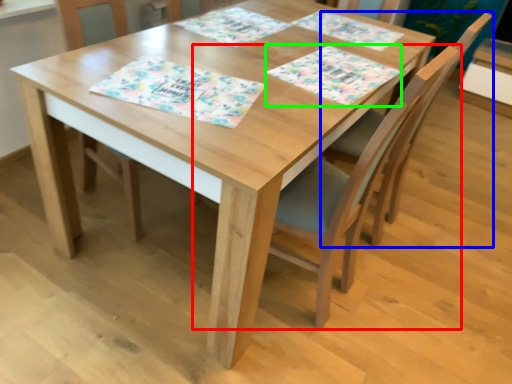
Question: Which object is the closest to the chair (highlighted by a red box)? Choose among these: chair (highlighted by a blue box) or place mat (highlighted by a green box).

Choices:
 (A) chair
 (B) place mat

Answer: (A)